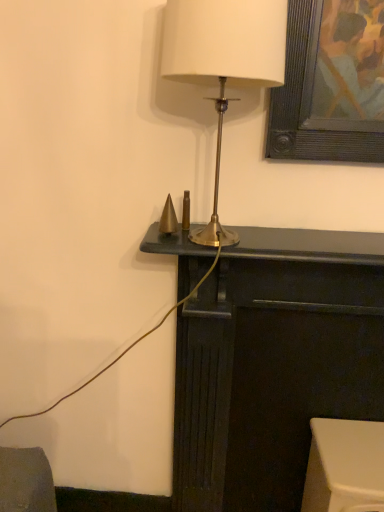
Question: Does dark wood fireplace at center, which ranks as the first furniture in left-to-right order, lie in front of white plastic stool at lower right, placed as the 2th furniture when sorted from left to right?

Choices:
 (A) no
 (B) yes

Answer: (B)

Question: From a real-world perspective, is dark wood fireplace at center, which ranks as the first furniture in left-to-right order, located beneath white plastic stool at lower right, placed as the 2th furniture when sorted from left to right?

Choices:
 (A) yes
 (B) no

Answer: (B)

Question: From the image's perspective, is dark wood fireplace at center, which ranks as the first furniture in left-to-right order, on white plastic stool at lower right, the 1th furniture from the right?

Choices:
 (A) yes
 (B) no

Answer: (A)

Question: From the image's perspective, is dark wood fireplace at center, which ranks as the first furniture in left-to-right order, under white plastic stool at lower right, placed as the 2th furniture when sorted from left to right?

Choices:
 (A) yes
 (B) no

Answer: (B)

Question: Can you confirm if dark wood fireplace at center, the 2th furniture when ordered from right to left, is thinner than white plastic stool at lower right, the 1th furniture from the right?

Choices:
 (A) yes
 (B) no

Answer: (A)

Question: Is dark wood fireplace at center, which ranks as the first furniture in left-to-right order, bigger than white plastic stool at lower right, the 1th furniture from the right?

Choices:
 (A) yes
 (B) no

Answer: (A)

Question: Is matte gold lamp at center smaller than white plastic stool at lower right, placed as the 2th furniture when sorted from left to right?

Choices:
 (A) yes
 (B) no

Answer: (B)

Question: Considering the relative positions of matte gold lamp at center and white plastic stool at lower right, the 1th furniture from the right, in the image provided, is matte gold lamp at center in front of white plastic stool at lower right, the 1th furniture from the right,?

Choices:
 (A) no
 (B) yes

Answer: (B)

Question: Is matte gold lamp at center at the right side of white plastic stool at lower right, placed as the 2th furniture when sorted from left to right?

Choices:
 (A) no
 (B) yes

Answer: (A)

Question: Could white plastic stool at lower right, the 1th furniture from the right, be considered to be inside matte gold lamp at center?

Choices:
 (A) no
 (B) yes

Answer: (A)

Question: From a real-world perspective, is matte gold lamp at center located higher than white plastic stool at lower right, the 1th furniture from the right?

Choices:
 (A) no
 (B) yes

Answer: (B)

Question: Is the depth of matte gold lamp at center greater than that of white plastic stool at lower right, the 1th furniture from the right?

Choices:
 (A) yes
 (B) no

Answer: (B)

Question: Does white plastic stool at lower right, the 1th furniture from the right, have a greater height compared to dark wood fireplace at center, which ranks as the first furniture in left-to-right order?

Choices:
 (A) no
 (B) yes

Answer: (A)